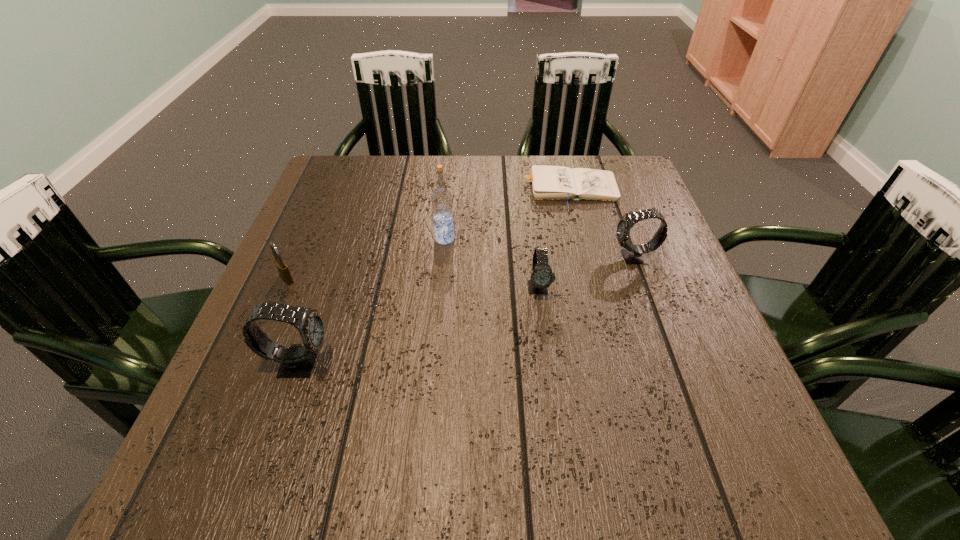
Locate which object ranks third in proximity to the padlock. Please provide its 2D coordinates. Your answer should be formatted as a tuple, i.e. [(x, y)], where the tuple contains the x and y coordinates of a point satisfying the conditions above.

[(541, 278)]

Find the location of a particular element. object that is the nearest to the third object from left to right is located at coordinates (541, 278).

You are a GUI agent. You are given a task and a screenshot of the screen. Output one action in this format:
    pyautogui.click(x=<x>, y=<y>)
    Task: Click on the watch object that ranks as the closest to the nearest object
    This screenshot has width=960, height=540.
    Given the screenshot: What is the action you would take?
    pyautogui.click(x=541, y=278)

Locate an element on the screen. The width and height of the screenshot is (960, 540). watch identified as the closest to the shortest object is located at coordinates (633, 254).

The height and width of the screenshot is (540, 960). I want to click on blank space that satisfies the following two spatial constraints: 1. on the face of the farthest watch; 2. on the face of the second farthest watch, so click(x=645, y=288).

Where is `free space that satisfies the following two spatial constraints: 1. on the back side of the fifth nearest object; 2. on the left side of the padlock`? free space that satisfies the following two spatial constraints: 1. on the back side of the fifth nearest object; 2. on the left side of the padlock is located at coordinates (304, 239).